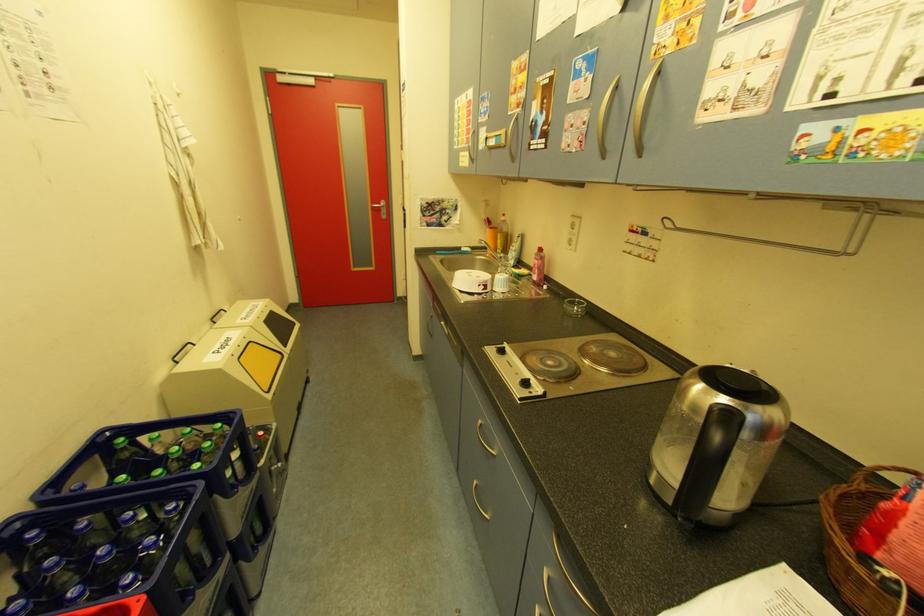
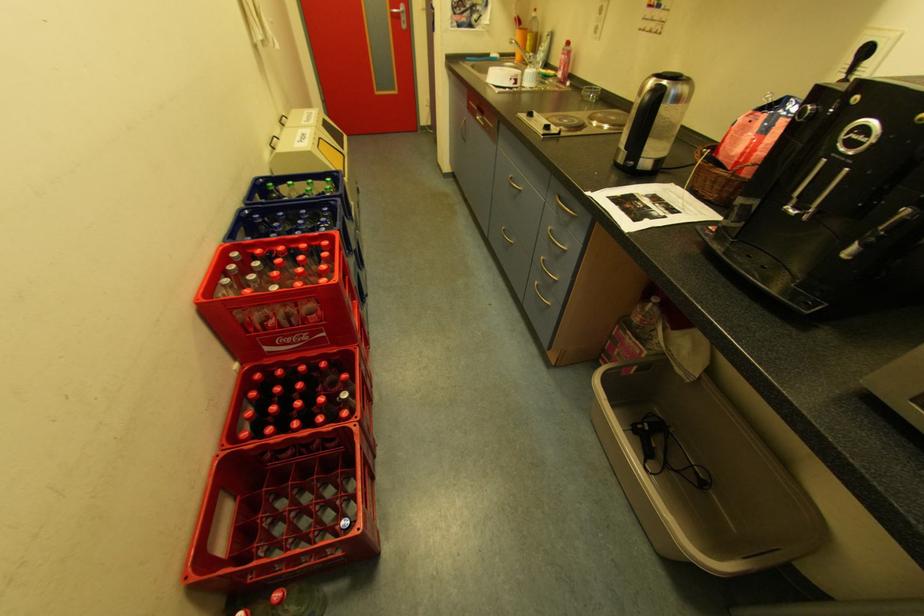
Question: The images are taken continuously from a first-person perspective. In which direction are you moving?

Choices:
 (A) Left
 (B) Right
 (C) Forward
 (D) Backward

Answer: (D)